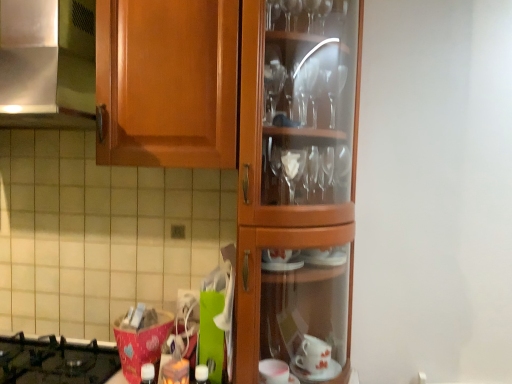
Question: Which is correct: white matte bottle at center is inside satin silver metal at upper left, or outside of it?

Choices:
 (A) inside
 (B) outside

Answer: (B)

Question: Based on their sizes in the image, would you say white matte bottle at center is bigger or smaller than satin silver metal at upper left?

Choices:
 (A) small
 (B) big

Answer: (A)

Question: Which object is the closest to the black glass gas stove at lower left?

Choices:
 (A) white matte bottle at center
 (B) satin silver metal at upper left

Answer: (A)

Question: Considering the real-world distances, which object is closest to the black glass gas stove at lower left?

Choices:
 (A) satin silver metal at upper left
 (B) white matte bottle at center

Answer: (B)